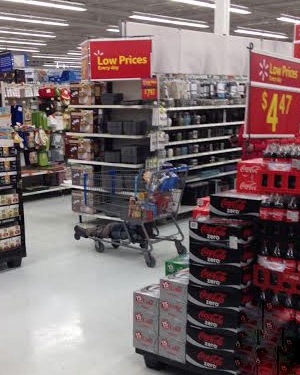
This screenshot has height=375, width=300. In order to click on towel in this screenshot , I will do `click(58, 156)`, `click(44, 161)`, `click(56, 141)`, `click(59, 121)`.